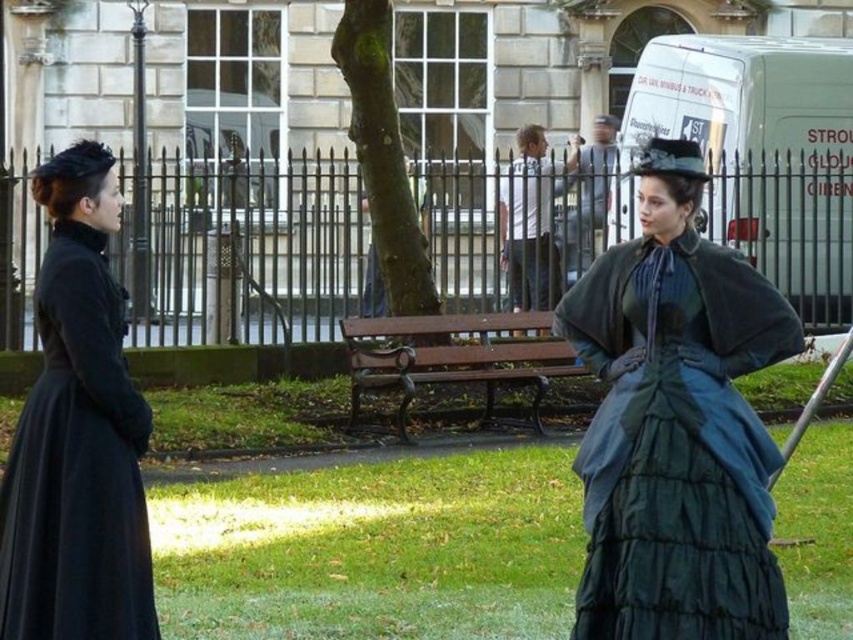
Question: Which object is the closest to the matte black dress at left?

Choices:
 (A) velvet teal dress at center
 (B) light gray shirt at center

Answer: (A)

Question: From the image, what is the correct spatial relationship of matte black dress at left in relation to wooden bench at center?

Choices:
 (A) below
 (B) above

Answer: (A)

Question: Which object is closer to the camera taking this photo?

Choices:
 (A) matte black dress at left
 (B) wooden bench at center

Answer: (A)

Question: Among these points, which one is nearest to the camera?

Choices:
 (A) (688, 173)
 (B) (136, 460)
 (C) (537, 195)

Answer: (B)

Question: Can you confirm if velvet teal dress at center is positioned to the right of light gray shirt at center?

Choices:
 (A) yes
 (B) no

Answer: (B)

Question: Can you confirm if matte black dress at left is thinner than wooden bench at center?

Choices:
 (A) no
 (B) yes

Answer: (B)